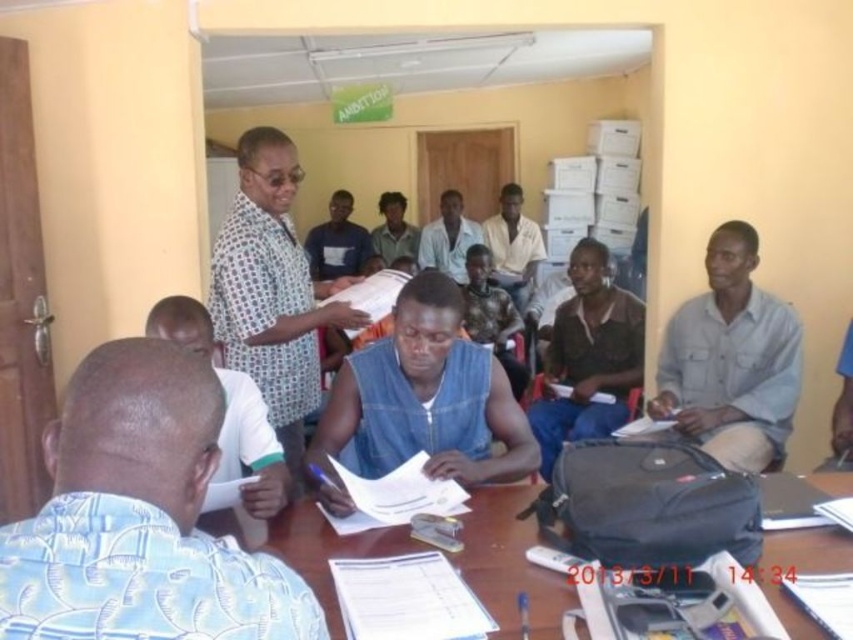
You are standing in the room and want to place a small plant on the wooden table at center. However, there is a brown textured shirt at center on the table. Can you place the plant there without moving the shirt?

The wooden table at center is positioned under brown textured shirt at center, meaning the shirt is on top of the table. Since the shirt is already occupying the surface, you would need to move it to place the plant there.

Consider the image. You are standing in the room and want to place a new item on the wooden table at center. Since the brown textured shirt at center is also present, can you reach the table without moving the shirt?

The wooden table at center is closer to the viewer than the brown textured shirt at center, so you can reach the table without moving the shirt.